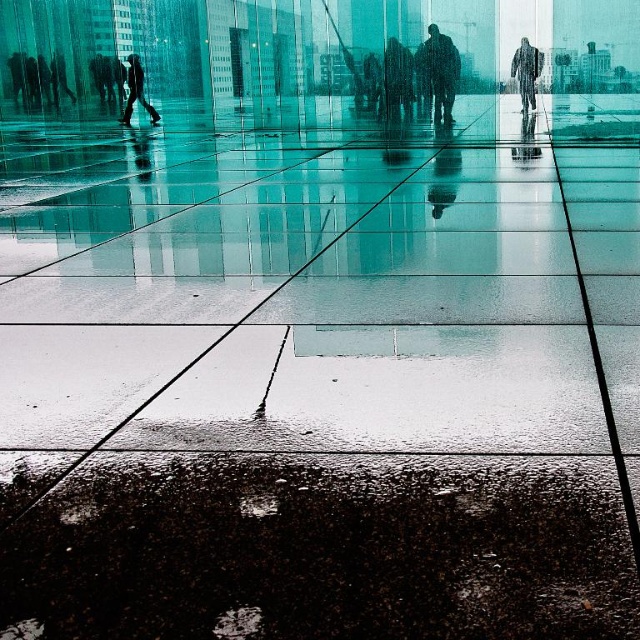
You are standing on the reflective glass floor and notice a point marked as point (x=397, y=80). What object is located at that point?

The point (x=397, y=80) corresponds to the matte black jacket at center.

You are an architect designing a new glass floor installation. You have two raincoats displayed on stands in the center and upper right. The silhouette raincoat at center is taller than the raincoat textured coat at upper right. Which raincoat would cast a longer shadow on the glass floor?

The silhouette raincoat at center would cast a longer shadow on the glass floor because it is taller than the raincoat textured coat at upper right.

You are standing on the reflective glass floor in the image. There is a point marked at coordinates [442,72]. What object is reflected at this point?

The point at coordinates [442,72] corresponds to the silhouette raincoat at center.